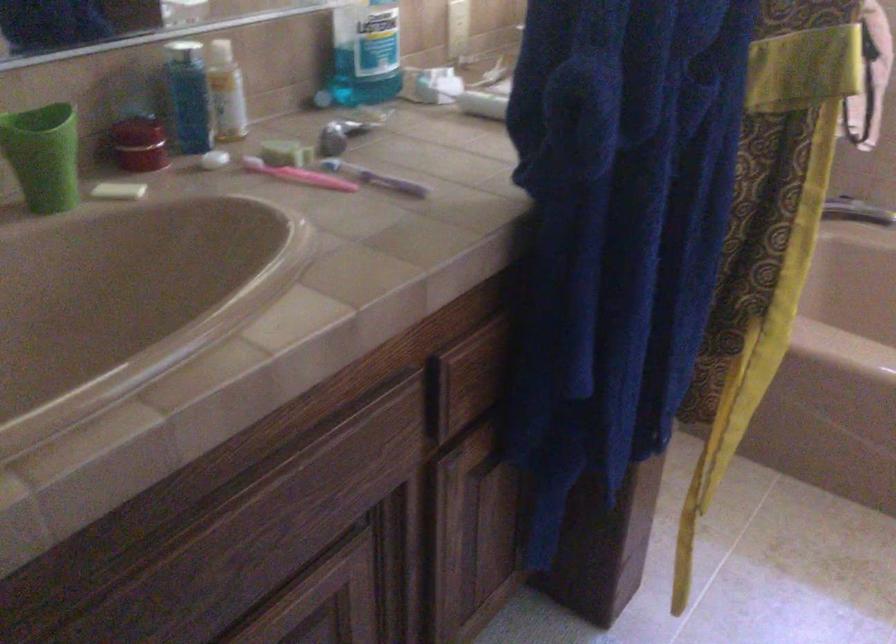
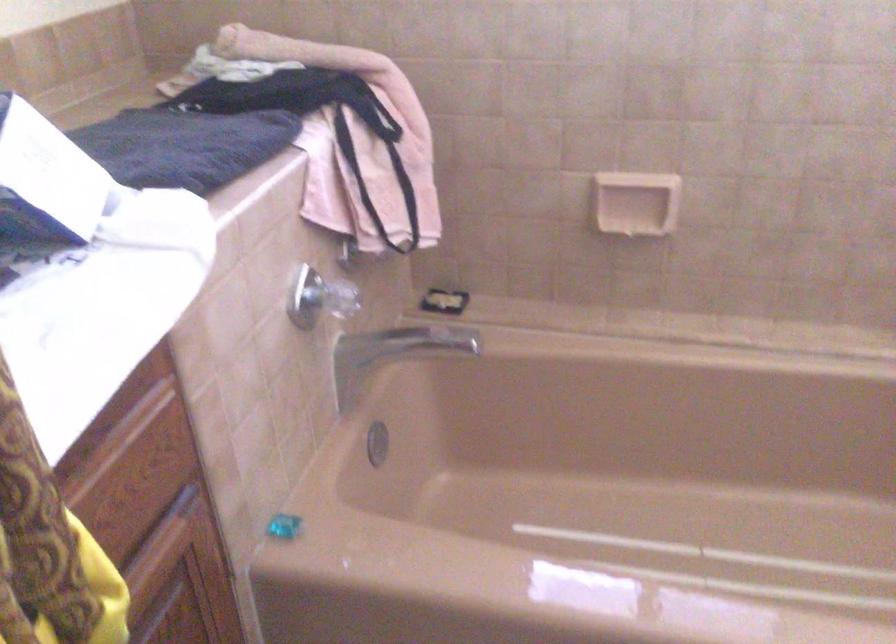
Question: Based on the continuous images, in which direction is the camera rotating? Reply with the corresponding letter.

Choices:
 (A) Left
 (B) Right
 (C) Up
 (D) Down

Answer: (B)